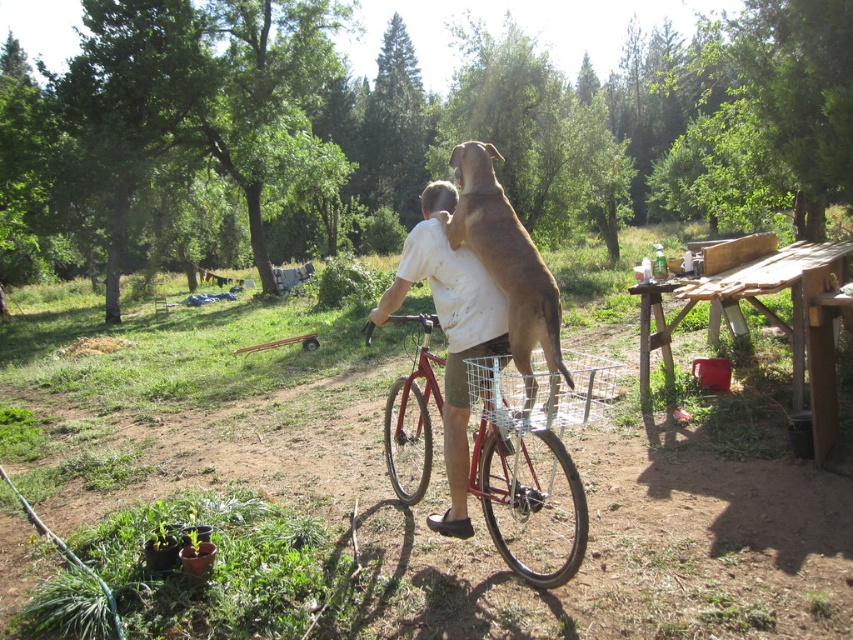
You are a photographer planning to take a photo of the wooden picnic table at right and the white matte shirt at center. Which object is located behind the other?

The wooden picnic table at right is positioned over the white matte shirt at center, meaning it is placed behind the shirt.

You are standing at the center of the image and want to place a small red wheelbarrow on the ground. Where should you put it so that it is closest to the wooden picnic table at right without being on top of it?

The wooden picnic table at right is located at point (775,314). To place the small red wheelbarrow closest to it without overlapping, position it near the coordinates (775,314) but slightly offset to ensure it remains separate from the table.

You are a photographer trying to capture the man and his dog in the scene. Since the white matte shirt at center and the metallic red bicycle at center are both in the frame, which one should you focus on to ensure the subject is clearly visible?

The white matte shirt at center has a larger size compared to the metallic red bicycle at center, so focusing on the white matte shirt at center would ensure the subject is clearly visible due to its larger size.